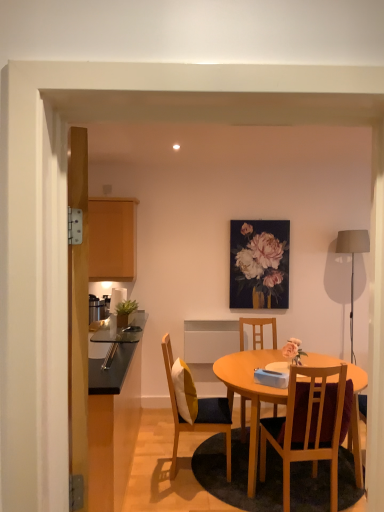
This screenshot has width=384, height=512. Describe the element at coordinates (261, 258) in the screenshot. I see `matte floral painting at upper center` at that location.

What is the approximate width of wooden chair at center, arranged as the first chair when viewed from the right?

wooden chair at center, arranged as the first chair when viewed from the right, is 20.61 inches wide.

Image resolution: width=384 pixels, height=512 pixels. Describe the element at coordinates (308, 426) in the screenshot. I see `wooden chair at center, the 3th chair in the back-to-front sequence` at that location.

The width and height of the screenshot is (384, 512). What do you see at coordinates (198, 413) in the screenshot? I see `wooden chair with cushion at center, the 2th chair positioned from the front` at bounding box center [198, 413].

Measure the distance between wooden table at center and camera.

2.59 meters.

What do you see at coordinates (352, 262) in the screenshot? The height and width of the screenshot is (512, 384). I see `matte gray fabric lampshade at right` at bounding box center [352, 262].

This screenshot has width=384, height=512. Find the location of `matte floral painting at upper center`. matte floral painting at upper center is located at coordinates (261, 258).

Is wooden table at center facing away from wooden chair at center, which appears as the 1th chair when viewed from the front?

No, wooden chair at center, which appears as the 1th chair when viewed from the front, is not at the back of wooden table at center.

The width and height of the screenshot is (384, 512). Identify the location of kitchen & dining room table located below the wooden chair at center, arranged as the first chair when viewed from the right (from the image's perspective). (250, 391).

Is wooden table at center to the left or to the right of wooden chair at center, the 3th chair in the back-to-front sequence, in the image?

wooden table at center is to the right of wooden chair at center, the 3th chair in the back-to-front sequence.

From a real-world perspective, does matte wood cabinet at left sit lower than wooden chair with cushion at center, the 2th chair positioned from the front?

Actually, matte wood cabinet at left is physically above wooden chair with cushion at center, the 2th chair positioned from the front, in the real world.

Can we say matte wood cabinet at left lies outside wooden chair with cushion at center, the 1th chair from the left?

That's correct, matte wood cabinet at left is outside of wooden chair with cushion at center, the 1th chair from the left.

Is matte wood cabinet at left far away from wooden chair with cushion at center, the 2th chair positioned from the front?

Yes, matte wood cabinet at left is far from wooden chair with cushion at center, the 2th chair positioned from the front.

Between matte wood cabinet at left and wooden chair with cushion at center, the 2th chair positioned from the front, which one is positioned in front?

Positioned in front is wooden chair with cushion at center, the 2th chair positioned from the front.

Looking at their sizes, would you say wooden chair at center, the 3th chair in the back-to-front sequence, is wider or thinner than matte gray fabric lampshade at right?

wooden chair at center, the 3th chair in the back-to-front sequence, is wider than matte gray fabric lampshade at right.

Is wooden chair at center, which appears as the 1th chair when viewed from the front, positioned with its back to matte gray fabric lampshade at right?

No, wooden chair at center, which appears as the 1th chair when viewed from the front, is not facing away from matte gray fabric lampshade at right.

Is matte gray fabric lampshade at right located within wooden chair at center, arranged as the first chair when viewed from the right?

No, matte gray fabric lampshade at right is not surrounded by wooden chair at center, arranged as the first chair when viewed from the right.

Do you think wooden table at center is within matte gray fabric lampshade at right, or outside of it?

wooden table at center is not inside matte gray fabric lampshade at right, it's outside.

Can you confirm if wooden table at center is smaller than matte gray fabric lampshade at right?

No, wooden table at center is not smaller than matte gray fabric lampshade at right.

From a real-world perspective, which object stands above the other?

matte gray fabric lampshade at right, from a real-world perspective.

Is the depth of wooden table at center greater than that of matte gray fabric lampshade at right?

No, the depth of wooden table at center is less than that of matte gray fabric lampshade at right.

Does matte floral painting at upper center have a smaller size compared to wooden chair with cushion at center, arranged as the 3th chair when viewed from the right?

Yes, matte floral painting at upper center is smaller than wooden chair with cushion at center, arranged as the 3th chair when viewed from the right.

Identify the location of flower above the wooden chair with cushion at center, the 2th chair positioned from the front (from the image's perspective). (261, 258).

Is point (255, 252) positioned before point (223, 428)?

No, (255, 252) is further to viewer.

How many degrees apart are the facing directions of matte floral painting at upper center and wooden chair with cushion at center, arranged as the 3th chair when viewed from the right?

The angle between the facing direction of matte floral painting at upper center and the facing direction of wooden chair with cushion at center, arranged as the 3th chair when viewed from the right, is 84.4 degrees.

You are a GUI agent. You are given a task and a screenshot of the screen. Output one action in this format:
    pyautogui.click(x=<x>, y=<y>)
    Task: Click on the flower located behind the wooden table at center
    The width and height of the screenshot is (384, 512).
    Given the screenshot: What is the action you would take?
    pyautogui.click(x=261, y=258)

Based on the photo, considering the sizes of wooden table at center and matte floral painting at upper center in the image, is wooden table at center taller or shorter than matte floral painting at upper center?

wooden table at center is shorter than matte floral painting at upper center.

Does wooden table at center have a smaller size compared to matte floral painting at upper center?

Actually, wooden table at center might be larger than matte floral painting at upper center.

Is point (184, 426) farther from viewer compared to point (275, 261)?

No, it is not.

Looking at the image, does matte gray fabric lampshade at right seem bigger or smaller compared to wooden chair at center, the 3th chair in the back-to-front sequence?

In the image, matte gray fabric lampshade at right appears to be smaller than wooden chair at center, the 3th chair in the back-to-front sequence.

From a real-world perspective, which chair is the 1st one underneath the matte gray fabric lampshade at right? Please provide its 2D coordinates.

[(308, 426)]

Which is behind, matte gray fabric lampshade at right or wooden chair at center, placed as the 3th chair when sorted from left to right?

Positioned behind is matte gray fabric lampshade at right.

At what (x,y) coordinates should I click in order to perform the action: click on kitchen & dining room table on the right of wooden chair at center, which appears as the 1th chair when viewed from the front. Please return your answer as a coordinate pair (x, y). Image resolution: width=384 pixels, height=512 pixels. Looking at the image, I should click on pos(250,391).

Find the location of a particular element. The width and height of the screenshot is (384, 512). cabinetry that is above the wooden chair with cushion at center, the 2th chair positioned from the front (from the image's perspective) is located at coordinates (112, 239).

From the image, which object appears to be farther from matte gray fabric lampshade at right, matte floral painting at upper center or wooden chair with cushion at center, arranged as the 3th chair when viewed from the right?

wooden chair with cushion at center, arranged as the 3th chair when viewed from the right.

Looking at the image, which one is located further to matte gray fabric lampshade at right, wooden table at center or matte wood cabinet at left?

matte wood cabinet at left is further to matte gray fabric lampshade at right.

From the image, which object appears to be farther from wooden table at center, wooden chair at center, arranged as the first chair when viewed from the right, or wooden chair with cushion at center, the 2th chair positioned from the front?

Among the two, wooden chair at center, arranged as the first chair when viewed from the right, is located further to wooden table at center.

Based on their spatial positions, is matte wood cabinet at left or wooden chair with cushion at center, the 2th chair when ordered from back to front, closer to wooden table at center?

Among the two, wooden chair with cushion at center, the 2th chair when ordered from back to front, is located nearer to wooden table at center.

Which object lies nearer to the anchor point matte wood cabinet at left, matte gray fabric lampshade at right or wooden chair at center, the second chair when ordered from right to left?

wooden chair at center, the second chair when ordered from right to left, is positioned closer to the anchor matte wood cabinet at left.

When comparing their distances from matte gray fabric lampshade at right, does wooden table at center or wooden chair at center, the first chair in the back-to-front sequence, seem closer?

wooden chair at center, the first chair in the back-to-front sequence.

Estimate the real-world distances between objects in this image. Which object is closer to wooden chair at center, the second chair when ordered from right to left, matte floral painting at upper center or matte gray fabric lampshade at right?

matte floral painting at upper center lies closer to wooden chair at center, the second chair when ordered from right to left, than the other object.

From the image, which object appears to be farther from matte floral painting at upper center, wooden table at center or matte gray fabric lampshade at right?

wooden table at center.

Locate an element on the screen. kitchen & dining room table between wooden chair at center, which appears as the 1th chair when viewed from the front, and matte gray fabric lampshade at right, along the z-axis is located at coordinates (250, 391).

In order to click on cabinetry between wooden chair at center, placed as the 3th chair when sorted from left to right, and matte floral painting at upper center from front to back in this screenshot , I will do `click(112, 239)`.

You are a GUI agent. You are given a task and a screenshot of the screen. Output one action in this format:
    pyautogui.click(x=<x>, y=<y>)
    Task: Click on the kitchen & dining room table between wooden chair at center, placed as the 3th chair when sorted from left to right, and matte floral painting at upper center in the front-back direction
    The image size is (384, 512).
    Given the screenshot: What is the action you would take?
    pyautogui.click(x=250, y=391)

Locate an element on the screen. The height and width of the screenshot is (512, 384). chair positioned between wooden table at center and wooden chair at center, the second chair when ordered from right to left, from near to far is located at coordinates (198, 413).